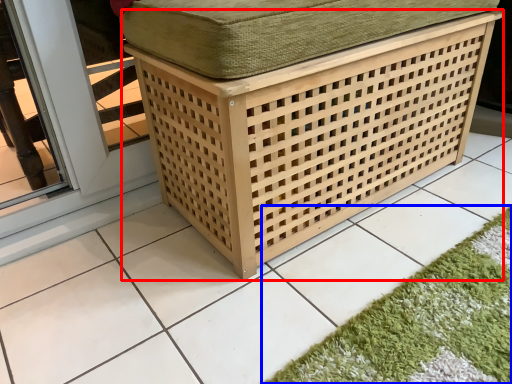
Question: Which object appears farthest to the camera in this image, furniture (highlighted by a red box) or bath mat (highlighted by a blue box)?

Choices:
 (A) furniture
 (B) bath mat

Answer: (A)